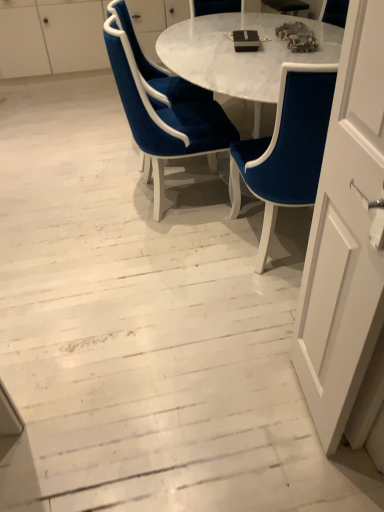
Question: Is velvet blue chair at center, arranged as the 3th chair when viewed from the right, to the left or to the right of velvet blue chair at center, which appears as the 2th chair when viewed from the left, in the image?

Choices:
 (A) right
 (B) left

Answer: (B)

Question: Relative to velvet blue chair at center, acting as the 2th chair starting from the right, is velvet blue chair at center, arranged as the 3th chair when viewed from the right, in front or behind?

Choices:
 (A) front
 (B) behind

Answer: (B)

Question: Which is nearer to the velvet blue chair at center, acting as the 2th chair starting from the right?

Choices:
 (A) velvet blue chair at center, the first chair positioned from the left
 (B) velvet blue chair at center, the 3th chair from the left
 (C) white glossy dresser at upper center

Answer: (A)

Question: Considering the real-world distances, which object is farthest from the white glossy dresser at upper center?

Choices:
 (A) velvet blue chair at center, which appears as the 2th chair when viewed from the left
 (B) velvet blue chair at center, the first chair positioned from the left
 (C) velvet blue chair at center, which is the 1th chair from right to left

Answer: (C)